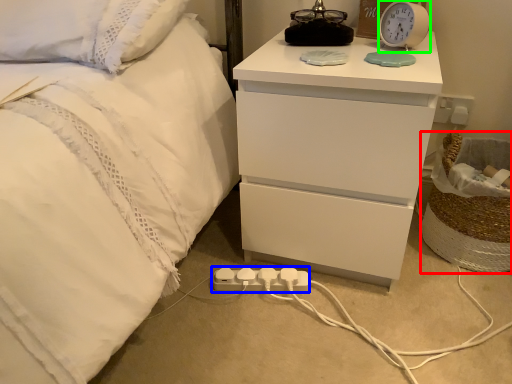
Question: Considering the real-world distances, which object is farthest from laundry basket (highlighted by a red box)? extension cord (highlighted by a blue box) or alarm clock (highlighted by a green box)?

Choices:
 (A) extension cord
 (B) alarm clock

Answer: (A)